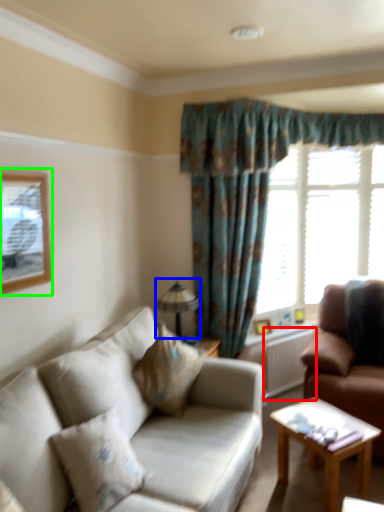
Question: Based on their relative distances, which object is farther from radiator (highlighted by a red box)? Choose from lamp (highlighted by a blue box) and picture frame (highlighted by a green box).

Choices:
 (A) lamp
 (B) picture frame

Answer: (B)